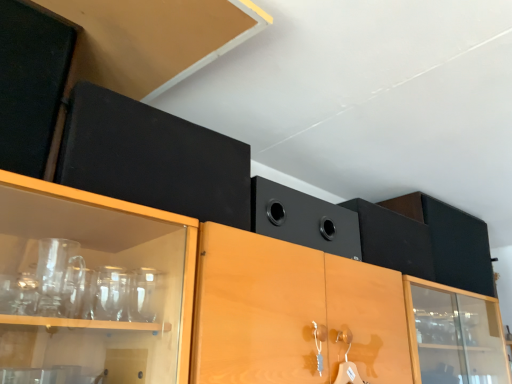
Question: Can you confirm if matte black cabinet at upper left is positioned to the right of black matte speaker at upper center?

Choices:
 (A) no
 (B) yes

Answer: (A)

Question: Is matte black cabinet at upper left located outside black matte speaker at upper center?

Choices:
 (A) no
 (B) yes

Answer: (B)

Question: Is matte black cabinet at upper left facing towards black matte speaker at upper center?

Choices:
 (A) yes
 (B) no

Answer: (B)

Question: Can you confirm if matte black cabinet at upper left is positioned to the left of black matte speaker at upper center?

Choices:
 (A) no
 (B) yes

Answer: (B)

Question: From the image's perspective, is matte black cabinet at upper left located beneath black matte speaker at upper center?

Choices:
 (A) no
 (B) yes

Answer: (A)

Question: Does matte black cabinet at upper left have a larger size compared to black matte speaker at upper center?

Choices:
 (A) no
 (B) yes

Answer: (A)

Question: Is black matte speaker at upper center to the right of matte black cabinet at upper left from the viewer's perspective?

Choices:
 (A) no
 (B) yes

Answer: (B)

Question: Does black matte speaker at upper center have a lesser width compared to matte black cabinet at upper left?

Choices:
 (A) no
 (B) yes

Answer: (A)

Question: Does black matte speaker at upper center have a lesser height compared to matte black cabinet at upper left?

Choices:
 (A) yes
 (B) no

Answer: (A)

Question: Would you say black matte speaker at upper center is outside matte black cabinet at upper left?

Choices:
 (A) yes
 (B) no

Answer: (A)

Question: From the image's perspective, is black matte speaker at upper center below matte black cabinet at upper left?

Choices:
 (A) yes
 (B) no

Answer: (A)

Question: From a real-world perspective, is black matte speaker at upper center located beneath matte black cabinet at upper left?

Choices:
 (A) yes
 (B) no

Answer: (A)

Question: Considering the positions of black matte speaker at upper center and matte black cabinet at upper left in the image, is black matte speaker at upper center wider or thinner than matte black cabinet at upper left?

Choices:
 (A) thin
 (B) wide

Answer: (B)